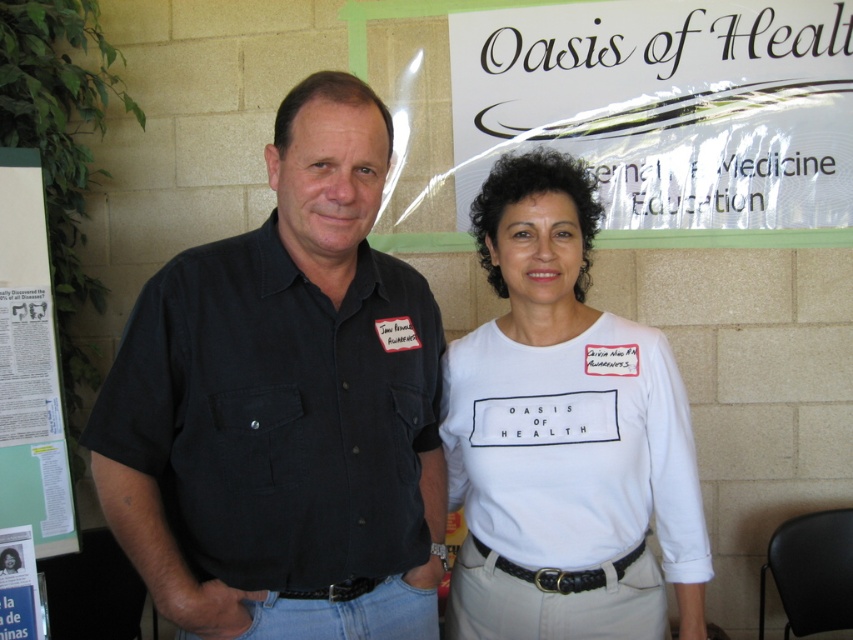
Which is more to the right, white cotton shirt at center or white paper poster at lower left?

white cotton shirt at center is more to the right.

What do you see at coordinates (564, 435) in the screenshot? This screenshot has height=640, width=853. I see `white cotton shirt at center` at bounding box center [564, 435].

Between point (524, 476) and point (10, 538), which one is positioned in front?

Positioned in front is point (524, 476).

What are the coordinates of `white cotton shirt at center` in the screenshot? It's located at (564, 435).

Is point (573, 273) less distant than point (630, 52)?

Yes, it is in front of point (630, 52).

The width and height of the screenshot is (853, 640). Describe the element at coordinates (564, 435) in the screenshot. I see `white cotton shirt at center` at that location.

Is point (575, 161) farther from camera compared to point (755, 154)?

No, it is in front of (755, 154).

Where is `white cotton shirt at center`? The height and width of the screenshot is (640, 853). white cotton shirt at center is located at coordinates (564, 435).

Locate an element on the screen. The height and width of the screenshot is (640, 853). white cotton shirt at center is located at coordinates (564, 435).

Who is positioned more to the right, white cotton shirt at center or white paper at left?

white cotton shirt at center

Locate an element on the screen. The height and width of the screenshot is (640, 853). white cotton shirt at center is located at coordinates (564, 435).